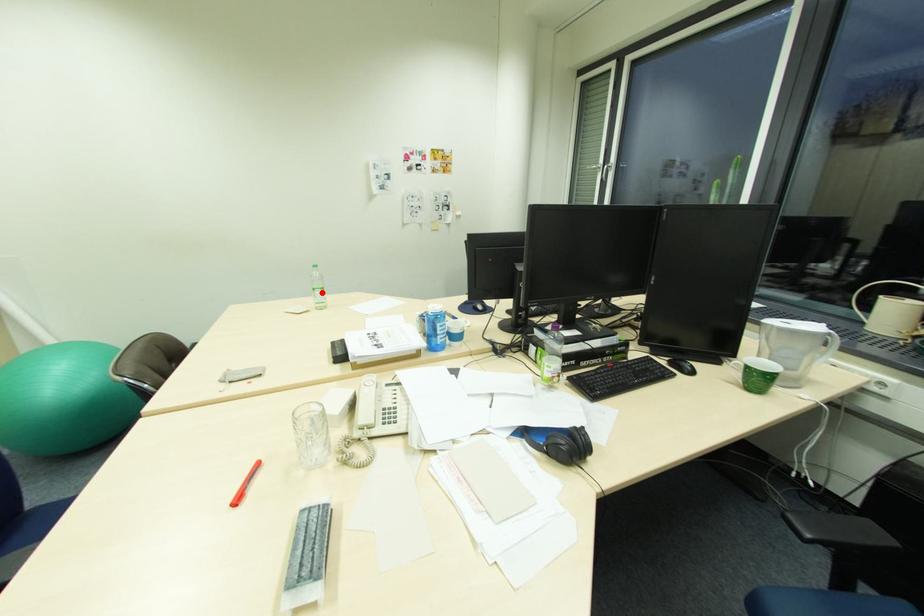
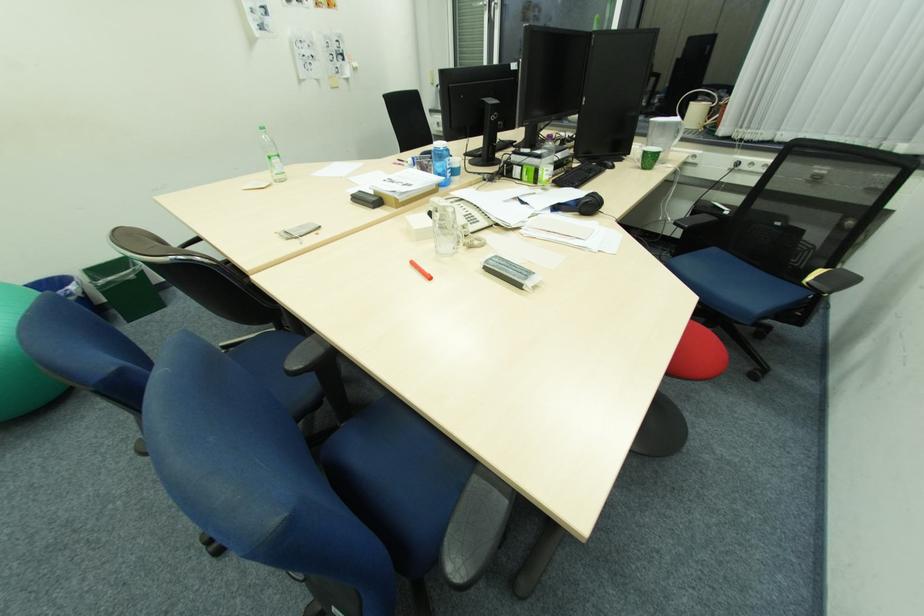
Find the pixel in the second image that matches the highlighted location in the first image.

(280, 161)